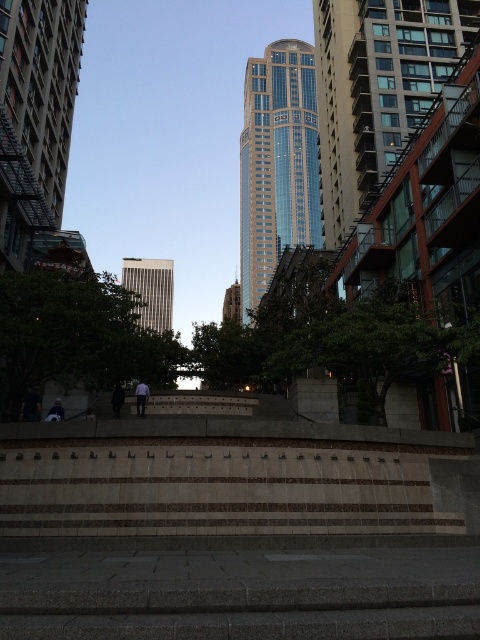
Consider the image. You are standing at the bottom of the stone steps and looking up. You see a shiny glass skyscraper at center and a dark blue fabric at center. Which object is higher up from your current position?

The shiny glass skyscraper at center is higher up from your current position because it is located above the dark blue fabric at center.

From the picture: You are standing at the bottom of the wide, tiered stone steps leading up to the plaza. You notice a shiny glass skyscraper at center and a dark blue fabric at center. Which object is farther away from you?

The shiny glass skyscraper at center is 199.99 meters away from the dark blue fabric at center, so the skyscraper is farther away from you than the dark blue fabric.